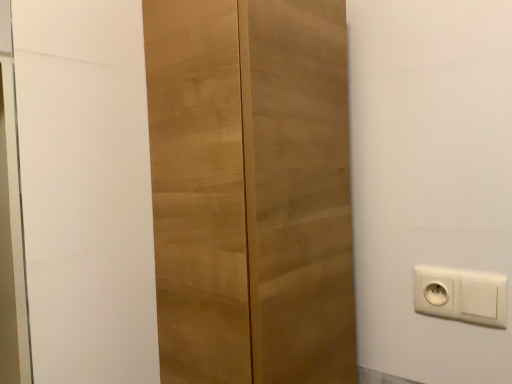
Identify the location of white plastic power plugs and sockets at lower right. (461, 295).

Image resolution: width=512 pixels, height=384 pixels. Describe the element at coordinates (461, 295) in the screenshot. I see `white plastic power plugs and sockets at lower right` at that location.

Based on the photo, what is the approximate height of white plastic power plugs and sockets at lower right?

It is 3.58 inches.

Find the location of a particular element. light wood cupboard at center is located at coordinates (251, 190).

This screenshot has width=512, height=384. Describe the element at coordinates (251, 190) in the screenshot. I see `light wood cupboard at center` at that location.

Where is `white plastic power plugs and sockets at lower right`? The height and width of the screenshot is (384, 512). white plastic power plugs and sockets at lower right is located at coordinates (461, 295).

Would you say light wood cupboard at center is to the left or to the right of white plastic power plugs and sockets at lower right in the picture?

light wood cupboard at center is positioned on white plastic power plugs and sockets at lower right's left side.

Which is in front, light wood cupboard at center or white plastic power plugs and sockets at lower right?

light wood cupboard at center.

Looking at this image, which point is more distant from viewer, (276, 221) or (483, 275)?

The point (483, 275) is more distant.

From the image's perspective, is light wood cupboard at center located above or below white plastic power plugs and sockets at lower right?

light wood cupboard at center is above white plastic power plugs and sockets at lower right.

Consider the image. From a real-world perspective, who is located higher, light wood cupboard at center or white plastic power plugs and sockets at lower right?

light wood cupboard at center.

From the picture: Between light wood cupboard at center and white plastic power plugs and sockets at lower right, which one has larger width?

Wider between the two is light wood cupboard at center.

In terms of height, does light wood cupboard at center look taller or shorter compared to white plastic power plugs and sockets at lower right?

In the image, light wood cupboard at center appears to be taller than white plastic power plugs and sockets at lower right.

Considering the sizes of light wood cupboard at center and white plastic power plugs and sockets at lower right in the image, is light wood cupboard at center bigger or smaller than white plastic power plugs and sockets at lower right?

Considering their sizes, light wood cupboard at center takes up more space than white plastic power plugs and sockets at lower right.

Is light wood cupboard at center surrounding white plastic power plugs and sockets at lower right?

That's incorrect, white plastic power plugs and sockets at lower right is not inside light wood cupboard at center.

Is light wood cupboard at center directly adjacent to white plastic power plugs and sockets at lower right?

No.

Based on the photo, is light wood cupboard at center looking in the opposite direction of white plastic power plugs and sockets at lower right?

light wood cupboard at center is not turned away from white plastic power plugs and sockets at lower right.

How different are the orientations of light wood cupboard at center and white plastic power plugs and sockets at lower right in degrees?

The angle between the facing direction of light wood cupboard at center and the facing direction of white plastic power plugs and sockets at lower right is 92 degrees.

How much distance is there between light wood cupboard at center and white plastic power plugs and sockets at lower right?

light wood cupboard at center is 15.29 inches away from white plastic power plugs and sockets at lower right.

In the image, there is a light wood cupboard at center. In order to click on power plugs and sockets below it (from the image's perspective) in this screenshot , I will do `click(461, 295)`.

Considering the positions of objects white plastic power plugs and sockets at lower right and light wood cupboard at center in the image provided, who is more to the right, white plastic power plugs and sockets at lower right or light wood cupboard at center?

white plastic power plugs and sockets at lower right.

Which object is closer to the camera, white plastic power plugs and sockets at lower right or light wood cupboard at center?

light wood cupboard at center is in front.

Does point (429, 277) lie behind point (277, 348)?

Yes, point (429, 277) is farther from viewer.

From the image's perspective, would you say white plastic power plugs and sockets at lower right is positioned over light wood cupboard at center?

No, from the image's perspective, white plastic power plugs and sockets at lower right is not above light wood cupboard at center.

From a real-world perspective, which object rests below the other?

white plastic power plugs and sockets at lower right.

Which of these two, white plastic power plugs and sockets at lower right or light wood cupboard at center, is wider?

light wood cupboard at center is wider.

Who is taller, white plastic power plugs and sockets at lower right or light wood cupboard at center?

Standing taller between the two is light wood cupboard at center.

Can you confirm if white plastic power plugs and sockets at lower right is smaller than light wood cupboard at center?

Indeed, white plastic power plugs and sockets at lower right has a smaller size compared to light wood cupboard at center.

Is light wood cupboard at center completely or partially inside white plastic power plugs and sockets at lower right?

No, white plastic power plugs and sockets at lower right does not contain light wood cupboard at center.

Are white plastic power plugs and sockets at lower right and light wood cupboard at center located far from each other?

No, white plastic power plugs and sockets at lower right is in close proximity to light wood cupboard at center.

Is white plastic power plugs and sockets at lower right aimed at light wood cupboard at center?

No, white plastic power plugs and sockets at lower right does not turn towards light wood cupboard at center.

Where is `power plugs and sockets lying behind the light wood cupboard at center`? The image size is (512, 384). power plugs and sockets lying behind the light wood cupboard at center is located at coordinates click(461, 295).

Where is `power plugs and sockets on the right of light wood cupboard at center`? The height and width of the screenshot is (384, 512). power plugs and sockets on the right of light wood cupboard at center is located at coordinates (461, 295).

This screenshot has width=512, height=384. In order to click on power plugs and sockets below the light wood cupboard at center (from a real-world perspective) in this screenshot , I will do `click(461, 295)`.